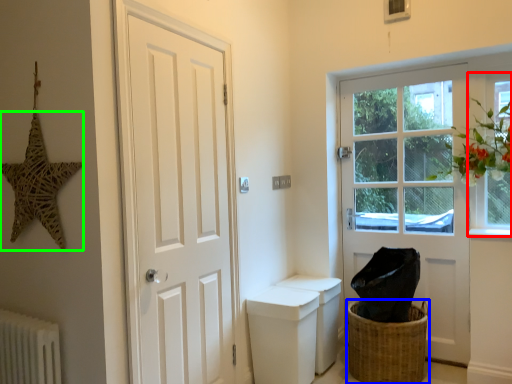
Question: Estimate the real-world distances between objects in this image. Which object is farther from window (highlighted by a red box), basket (highlighted by a blue box) or star (highlighted by a green box)?

Choices:
 (A) basket
 (B) star

Answer: (B)